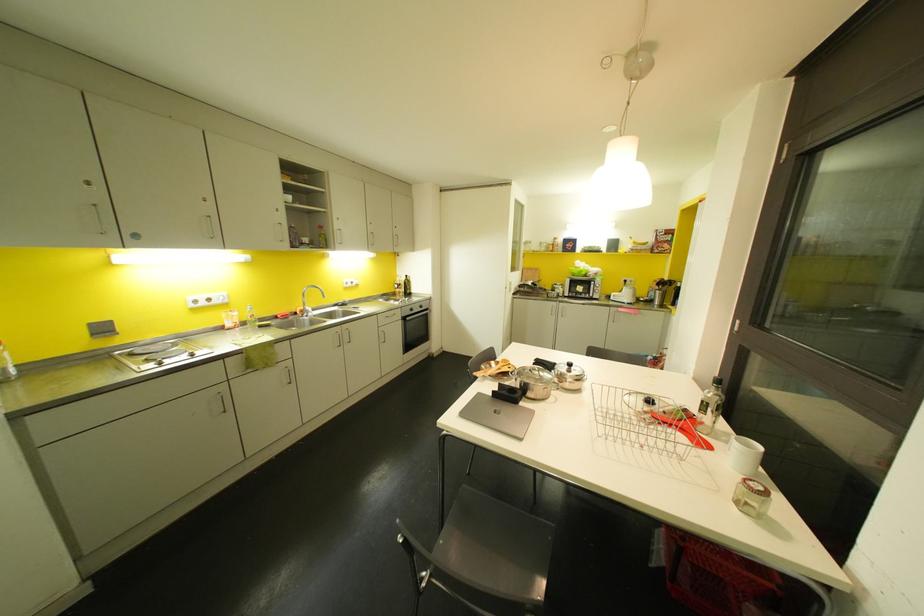
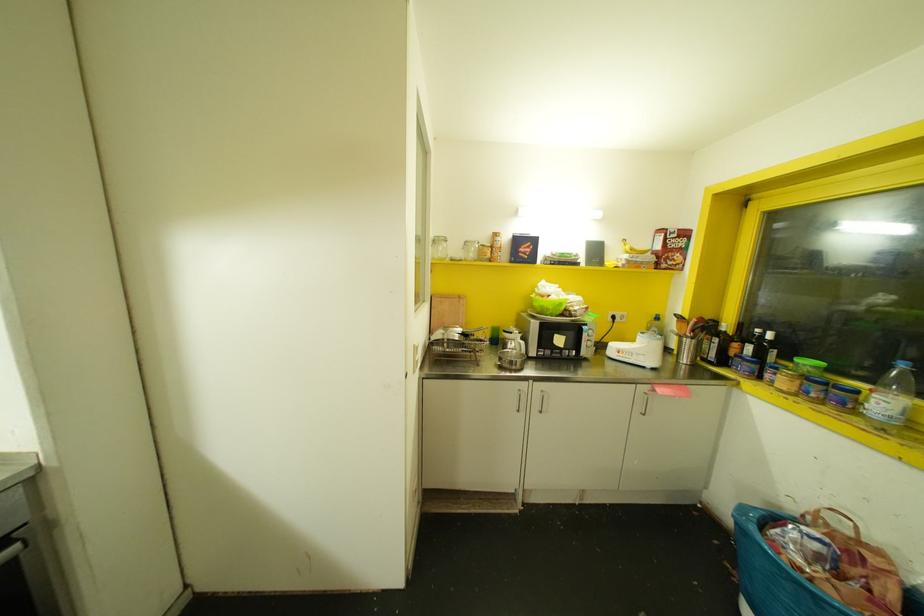
Locate, in the second image, the point that corresponds to (x=541, y=248) in the first image.

(470, 254)